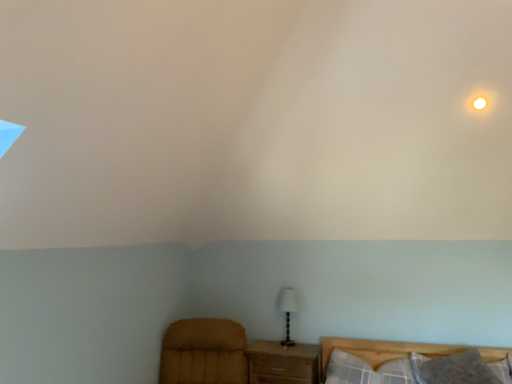
Question: Can you confirm if wooden nightstand at lower center is taller than velvet brown armchair at lower left?

Choices:
 (A) no
 (B) yes

Answer: (A)

Question: Does wooden nightstand at lower center appear on the right side of velvet brown armchair at lower left?

Choices:
 (A) no
 (B) yes

Answer: (B)

Question: Is wooden nightstand at lower center not near velvet brown armchair at lower left?

Choices:
 (A) yes
 (B) no

Answer: (B)

Question: From the image's perspective, would you say wooden nightstand at lower center is positioned over velvet brown armchair at lower left?

Choices:
 (A) yes
 (B) no

Answer: (B)

Question: Considering the relative sizes of wooden nightstand at lower center and velvet brown armchair at lower left in the image provided, is wooden nightstand at lower center wider than velvet brown armchair at lower left?

Choices:
 (A) no
 (B) yes

Answer: (A)

Question: Would you say gray soft pillow at lower right, the first pillow when ordered from right to left, is to the left or to the right of plaid fabric pillow at lower right, the 1th pillow positioned from the left, in the picture?

Choices:
 (A) right
 (B) left

Answer: (A)

Question: Looking at the image, does gray soft pillow at lower right, the 2th pillow when ordered from left to right, seem bigger or smaller compared to plaid fabric pillow at lower right, the second pillow when ordered from right to left?

Choices:
 (A) big
 (B) small

Answer: (B)

Question: Is gray soft pillow at lower right, the first pillow when ordered from right to left, in front of or behind plaid fabric pillow at lower right, the second pillow when ordered from right to left, in the image?

Choices:
 (A) front
 (B) behind

Answer: (A)

Question: From a real-world perspective, is gray soft pillow at lower right, the 2th pillow when ordered from left to right, physically located above or below plaid fabric pillow at lower right, the second pillow when ordered from right to left?

Choices:
 (A) below
 (B) above

Answer: (B)

Question: Considering the positions of velvet brown armchair at lower left and white glossy light at upper right in the image, is velvet brown armchair at lower left taller or shorter than white glossy light at upper right?

Choices:
 (A) tall
 (B) short

Answer: (A)

Question: From a real-world perspective, is velvet brown armchair at lower left positioned above or below white glossy light at upper right?

Choices:
 (A) above
 (B) below

Answer: (B)

Question: Considering their positions, is velvet brown armchair at lower left located in front of or behind white glossy light at upper right?

Choices:
 (A) behind
 (B) front

Answer: (A)

Question: From the image's perspective, is velvet brown armchair at lower left located above or below white glossy light at upper right?

Choices:
 (A) below
 (B) above

Answer: (A)

Question: Is point (285, 292) positioned closer to the camera than point (352, 362)?

Choices:
 (A) closer
 (B) farther

Answer: (B)

Question: Looking at their shapes, would you say white fabric lampshade at center is wider or thinner than plaid fabric pillow at lower right, the 1th pillow positioned from the left?

Choices:
 (A) wide
 (B) thin

Answer: (B)